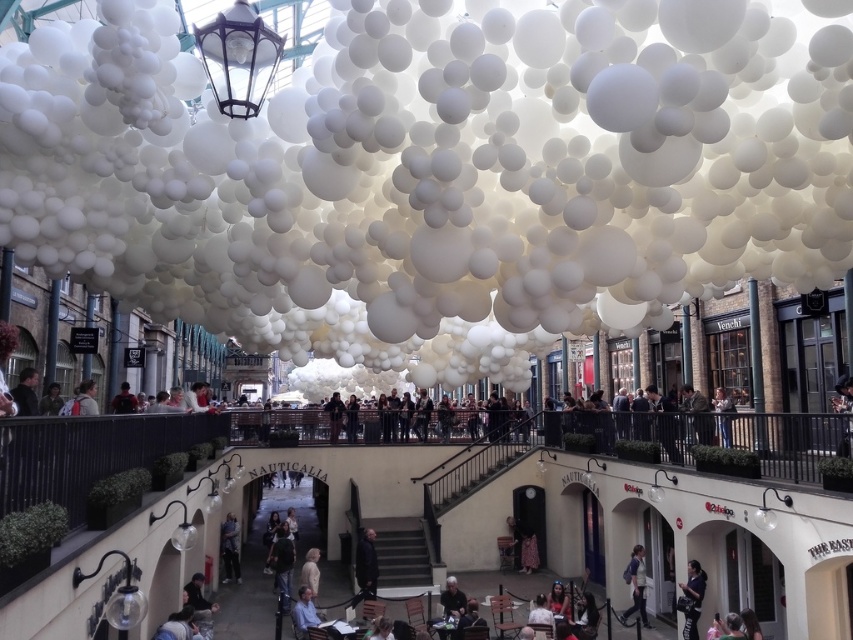
You are standing in the shopping arcade and see the light blue shirt at lower center. What is the color of the clothing item located at the coordinates point [305,612]?

The point [305,612] corresponds to the light blue shirt at lower center, so the clothing item there is light blue.

You are a photographer trying to capture a candid shot of the light blue shirt at lower center and the dark gray fabric jacket at lower center. Since you want both subjects to be clearly visible in the frame, which one should you adjust your focus on to ensure the smaller subject is properly captured?

The light blue shirt at lower center occupies less space than the dark gray fabric jacket at lower center. To ensure the smaller subject is properly captured, focus on the light blue shirt at lower center.

You are a photographer trying to capture a candid shot of two people in the shopping arcade. You notice the light brown leather jacket at lower center and the blonde hair at lower center. Which of these two objects is smaller in size?

The light brown leather jacket at lower center is smaller in size compared to the blonde hair at lower center according to the description.